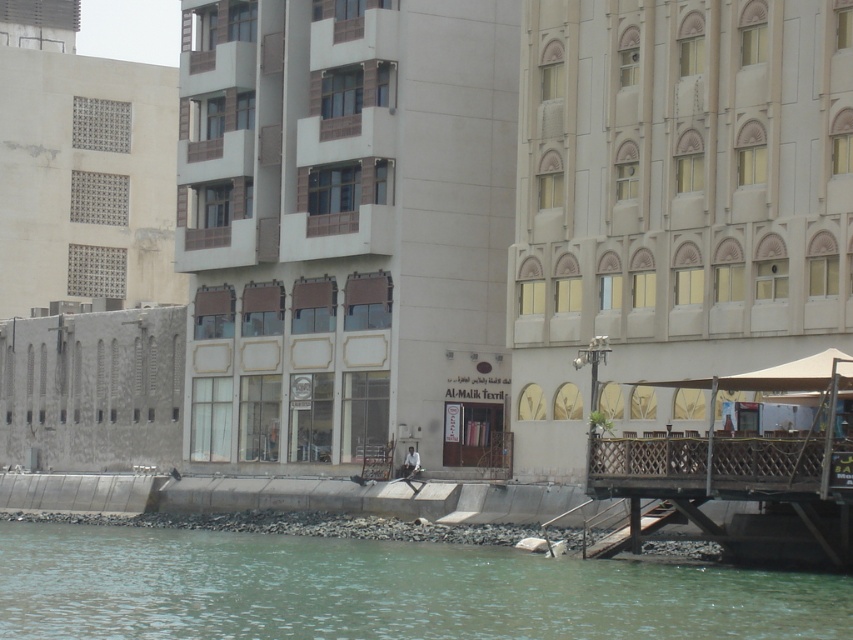
You are a city planner who needs to install a new streetlight between the beige concrete building at center and the beige stone building at center. The streetlight requires a minimum of 40 feet of space between the two buildings to be installed safely. Based on the scene description, can the streetlight be placed there?

The beige concrete building at center and beige stone building at center are 39.51 feet apart, which is less than the required 40 feet. Therefore, the streetlight cannot be safely installed between them.

You are standing at the origin point in the urban waterfront scene. Which direction should you move to reach the beige concrete building at center?

The beige concrete building at center is located at point 0.359 on the x and 0.407 on the y. Since you are at the origin, you should move northeast to reach it.

You are standing on the concrete embankment near the railing and want to take a photo of both the beige concrete building at center and the beige stone building at center. Which building should you position yourself closer to in order to capture both in a single frame?

To capture both the beige concrete building at center and the beige stone building at center in a single frame, you should position yourself closer to the beige concrete building at center since it is to the left of the beige stone building at center, allowing the camera to encompass both structures within the shot.